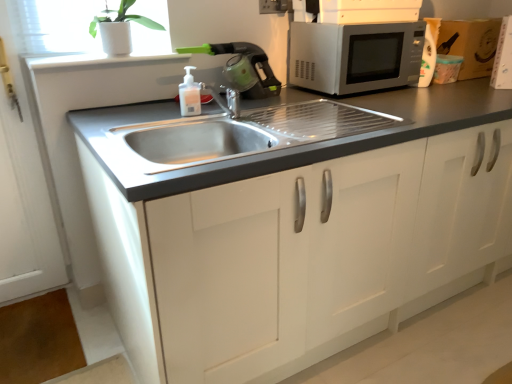
Question: Is the depth of white ceramic pot at upper left less than that of brown cardboard box at upper right?

Choices:
 (A) no
 (B) yes

Answer: (B)

Question: Does white ceramic pot at upper left have a greater height compared to brown cardboard box at upper right?

Choices:
 (A) no
 (B) yes

Answer: (A)

Question: Is white ceramic pot at upper left not close to brown cardboard box at upper right?

Choices:
 (A) yes
 (B) no

Answer: (A)

Question: Considering the relative sizes of white ceramic pot at upper left and brown cardboard box at upper right in the image provided, is white ceramic pot at upper left wider than brown cardboard box at upper right?

Choices:
 (A) no
 (B) yes

Answer: (B)

Question: Does white ceramic pot at upper left appear on the right side of brown cardboard box at upper right?

Choices:
 (A) yes
 (B) no

Answer: (B)

Question: Is white ceramic pot at upper left bigger or smaller than white matte cabinet at center?

Choices:
 (A) small
 (B) big

Answer: (A)

Question: Would you say white ceramic pot at upper left is inside or outside white matte cabinet at center?

Choices:
 (A) outside
 (B) inside

Answer: (A)

Question: From the image's perspective, is white ceramic pot at upper left above or below white matte cabinet at center?

Choices:
 (A) above
 (B) below

Answer: (A)

Question: In the image, is white ceramic pot at upper left positioned in front of or behind white matte cabinet at center?

Choices:
 (A) behind
 (B) front

Answer: (A)

Question: Is white matte cabinet at center in front of or behind white ceramic pot at upper left in the image?

Choices:
 (A) behind
 (B) front

Answer: (B)

Question: Choose the correct answer: Is white matte cabinet at center inside white ceramic pot at upper left or outside it?

Choices:
 (A) inside
 (B) outside

Answer: (B)

Question: From a real-world perspective, relative to white ceramic pot at upper left, is white matte cabinet at center vertically above or below?

Choices:
 (A) below
 (B) above

Answer: (A)

Question: From the image's perspective, relative to white ceramic pot at upper left, is white matte cabinet at center above or below?

Choices:
 (A) below
 (B) above

Answer: (A)

Question: In terms of height, does translucent plastic soap dispenser at center look taller or shorter compared to white matte cabinet at center?

Choices:
 (A) tall
 (B) short

Answer: (B)

Question: Is translucent plastic soap dispenser at center in front of or behind white matte cabinet at center in the image?

Choices:
 (A) behind
 (B) front

Answer: (A)